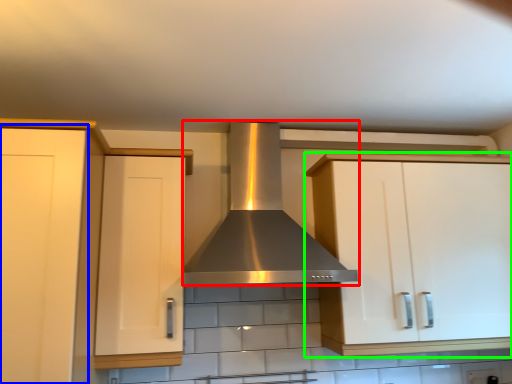
Question: Based on their relative distances, which object is nearer to home appliance (highlighted by a red box)? Choose from cabinetry (highlighted by a blue box) and cabinetry (highlighted by a green box).

Choices:
 (A) cabinetry
 (B) cabinetry

Answer: (B)